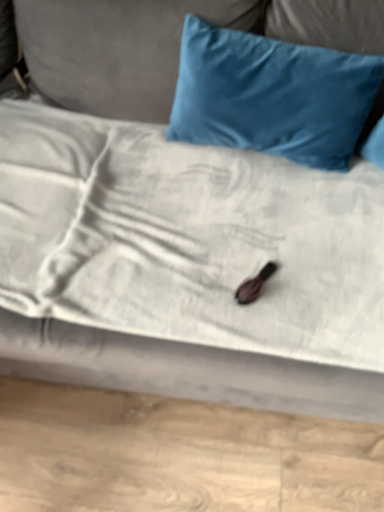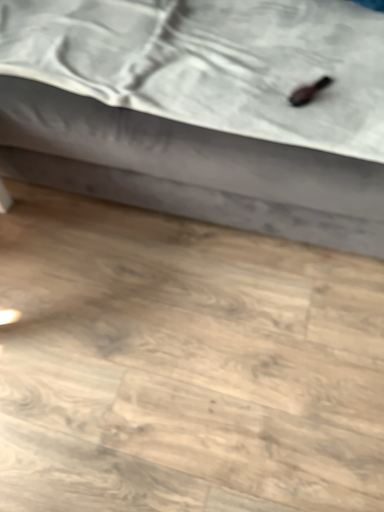
Question: How did the camera likely rotate when shooting the video?

Choices:
 (A) rotated left
 (B) rotated right

Answer: (A)